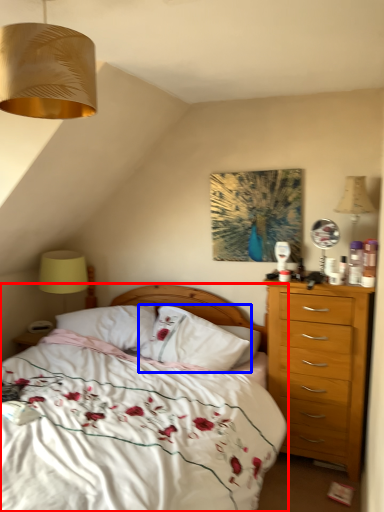
Question: Among these objects, which one is nearest to the camera, bed (highlighted by a red box) or pillow (highlighted by a blue box)?

Choices:
 (A) bed
 (B) pillow

Answer: (A)